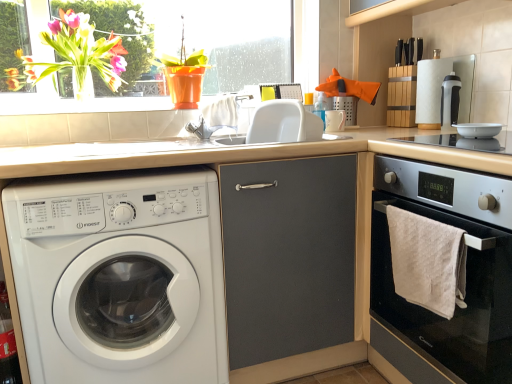
Question: Would you say matte gray cabinet at center is to the left or to the right of white plastic washing machine at left in the picture?

Choices:
 (A) right
 (B) left

Answer: (A)

Question: From the image's perspective, is matte gray cabinet at center positioned above or below white plastic washing machine at left?

Choices:
 (A) above
 (B) below

Answer: (A)

Question: Based on their relative distances, which object is farther from the transparent glass window at upper left?

Choices:
 (A) matte gray cabinet at center
 (B) translucent glass vase at upper left
 (C) clear glass wine bottle at lower left
 (D) white plastic sink at center
 (E) white glossy bowl at upper right

Answer: (C)

Question: Which object is positioned farthest from the beige laminate countertop at center?

Choices:
 (A) matte gray cabinet at center
 (B) white textured towel at lower right
 (C) black plastic coffee machine at upper right
 (D) white plastic sink at center
 (E) white glossy bowl at upper right

Answer: (E)